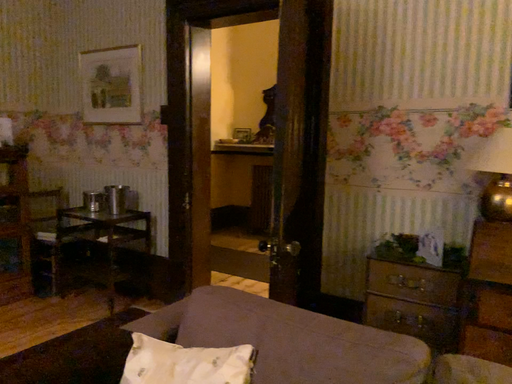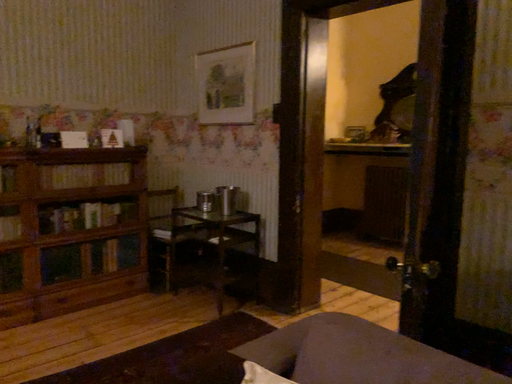
Question: How did the camera likely rotate when shooting the video?

Choices:
 (A) rotated right
 (B) rotated left

Answer: (B)